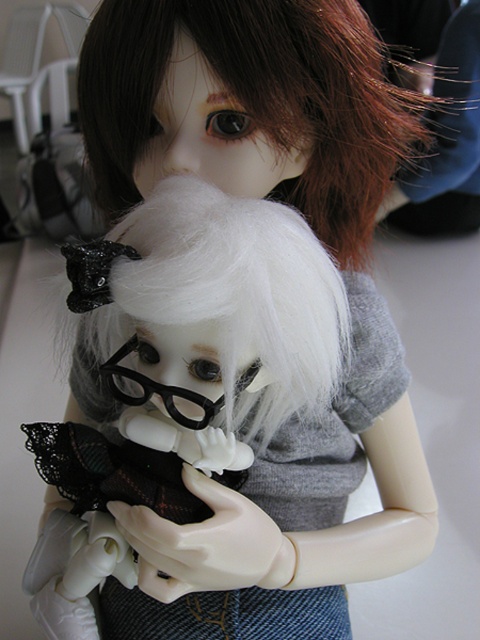
Is dark brown silky hair at upper center shorter than matte gray hair at upper center?

Correct, dark brown silky hair at upper center is not as tall as matte gray hair at upper center.

Is dark brown silky hair at upper center to the right of matte gray hair at upper center from the viewer's perspective?

Incorrect, dark brown silky hair at upper center is not on the right side of matte gray hair at upper center.

This screenshot has height=640, width=480. I want to click on dark brown silky hair at upper center, so click(257, 99).

At what (x,y) coordinates should I click in order to perform the action: click on dark brown silky hair at upper center. Please return your answer as a coordinate pair (x, y). This screenshot has width=480, height=640. Looking at the image, I should click on (257, 99).